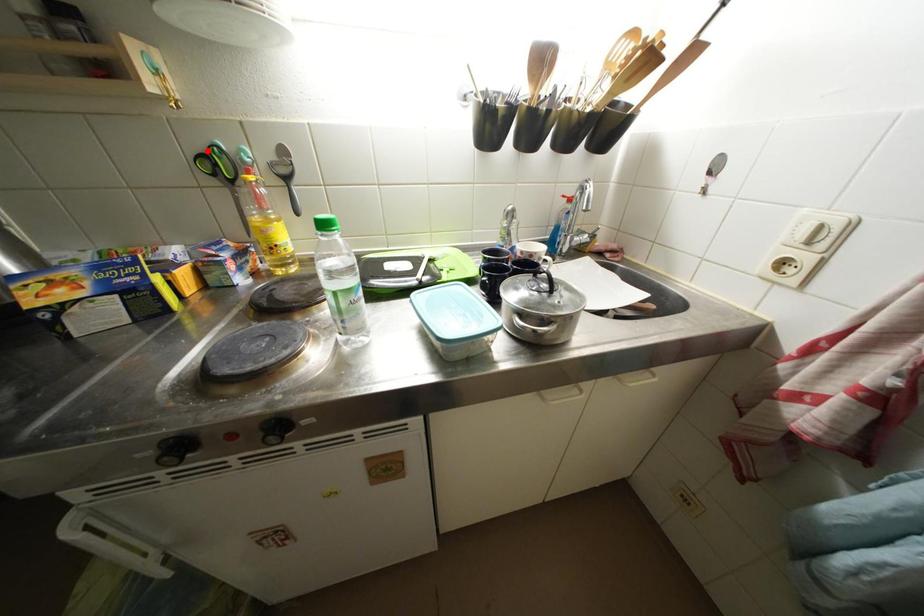
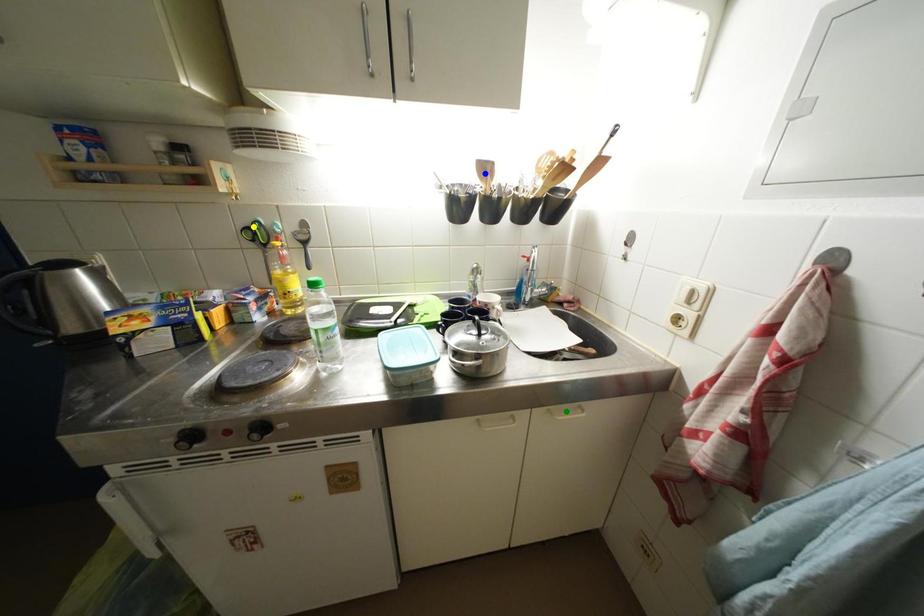
Question: I am providing you with two images of the same scene from different viewpoints. A red point is marked on the first image. You are given multiple points on the second image. Which mark in image 2 goes with the point in image 1?

Choices:
 (A) blue point
 (B) yellow point
 (C) green point

Answer: (B)